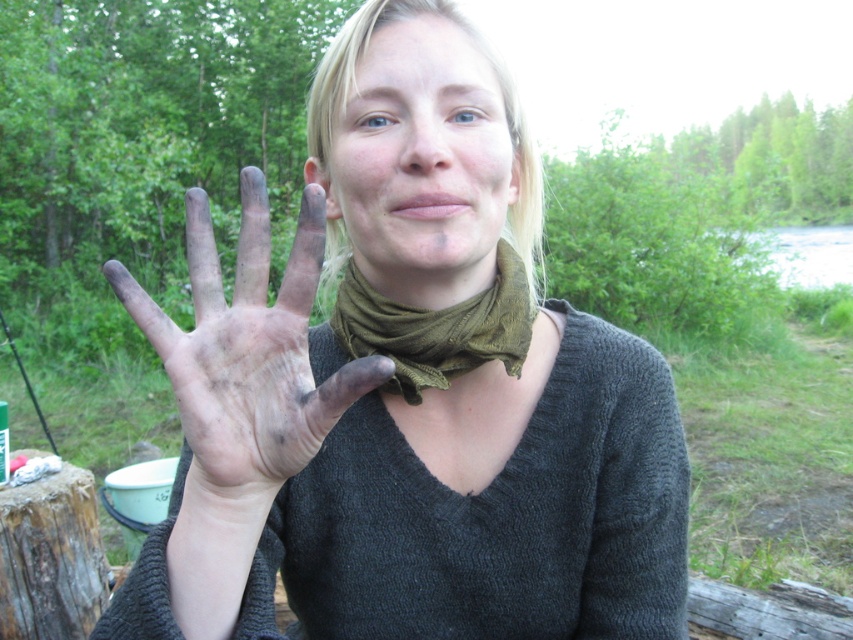
Which of these two, dirty skin at center or dirty clay hand at center, stands taller?

With more height is dirty skin at center.

The height and width of the screenshot is (640, 853). I want to click on dirty skin at center, so click(x=408, y=388).

This screenshot has width=853, height=640. I want to click on dirty skin at center, so click(408, 388).

Which of these two, dirty skin at center or green fabric scarf at center, stands shorter?

With less height is green fabric scarf at center.

Between point (160, 625) and point (372, 326), which one is positioned behind?

The point (372, 326) is behind.

Locate an element on the screen. The height and width of the screenshot is (640, 853). dirty skin at center is located at coordinates (408, 388).

Does dirty clay hand at center have a lesser width compared to green fabric scarf at center?

In fact, dirty clay hand at center might be wider than green fabric scarf at center.

Identify the location of dirty clay hand at center. This screenshot has width=853, height=640. [247, 353].

This screenshot has width=853, height=640. Identify the location of dirty clay hand at center. (247, 353).